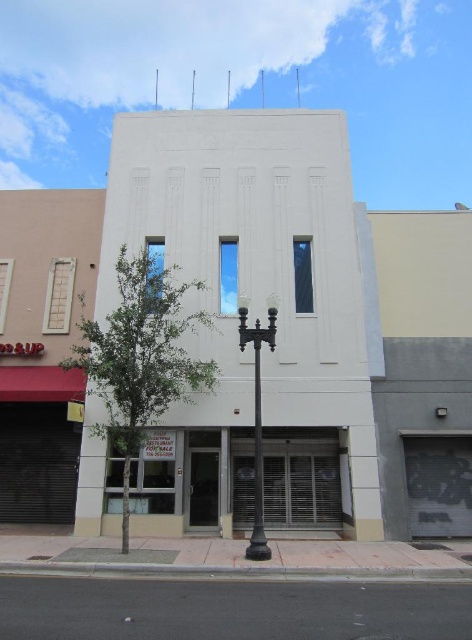
Between metallic silver storefront at center and black metal pole at center, which one appears on the right side from the viewer's perspective?

Positioned to the right is metallic silver storefront at center.

Is metallic silver storefront at center above black metal pole at center?

Incorrect, metallic silver storefront at center is not positioned above black metal pole at center.

The image size is (472, 640). Describe the element at coordinates (302, 477) in the screenshot. I see `metallic silver storefront at center` at that location.

Where is `metallic silver storefront at center`? This screenshot has width=472, height=640. metallic silver storefront at center is located at coordinates (302, 477).

This screenshot has width=472, height=640. Find the location of `metallic silver storefront at center`. metallic silver storefront at center is located at coordinates (302, 477).

Which is in front, point (303, 476) or point (258, 394)?

Point (258, 394) is more forward.

Where is `metallic silver storefront at center`? Image resolution: width=472 pixels, height=640 pixels. metallic silver storefront at center is located at coordinates (302, 477).

Is polished bronze streetlight at center bigger than black metal pole at center?

Actually, polished bronze streetlight at center might be smaller than black metal pole at center.

Between polished bronze streetlight at center and black metal pole at center, which one appears on the left side from the viewer's perspective?

From the viewer's perspective, black metal pole at center appears more on the left side.

Between point (261, 464) and point (259, 417), which one is positioned behind?

The point (259, 417) is behind.

Locate an element on the screen. The height and width of the screenshot is (640, 472). polished bronze streetlight at center is located at coordinates (258, 417).